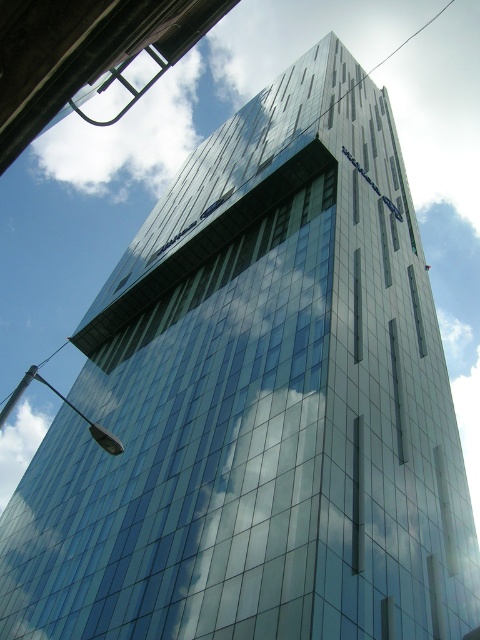
Is white fluffy cloud at upper left smaller than white cloud at upper left?

Incorrect, white fluffy cloud at upper left is not smaller in size than white cloud at upper left.

Who is more forward, (163, 120) or (3, 490)?

Point (163, 120) is in front.

The height and width of the screenshot is (640, 480). I want to click on white fluffy cloud at upper left, so click(x=127, y=136).

Looking at this image, between white cloud at upper left and transparent glass window at center, which one has less height?

transparent glass window at center

Can you confirm if white cloud at upper left is smaller than transparent glass window at center?

No.

Is point (4, 445) less distant than point (418, 300)?

No, (4, 445) is behind (418, 300).

Locate an element on the screen. This screenshot has width=480, height=640. white cloud at upper left is located at coordinates (19, 445).

Does white fluffy cloud at upper left appear over transparent glass window at center?

Yes.

Locate an element on the screen. Image resolution: width=480 pixels, height=640 pixels. white fluffy cloud at upper left is located at coordinates (127, 136).